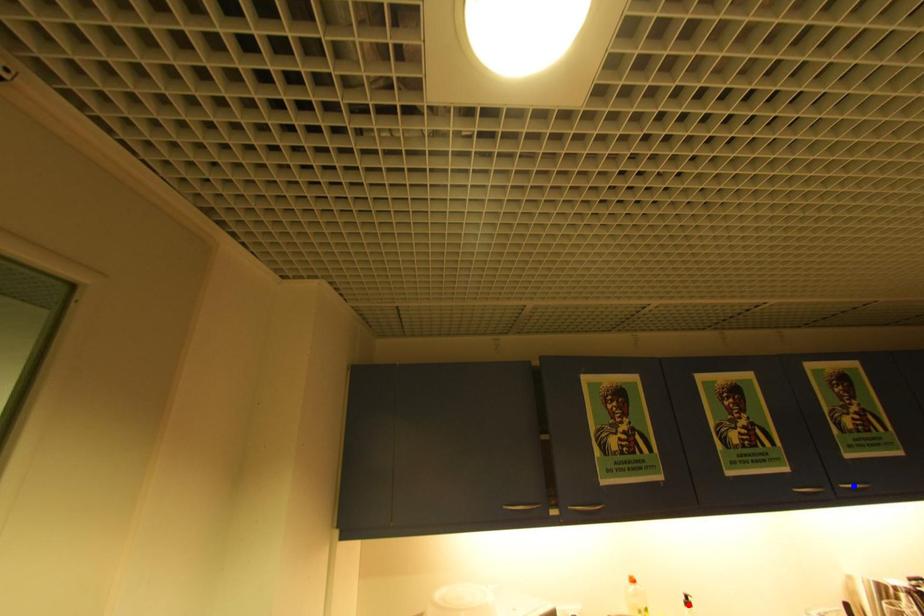
Question: Which of the two points in the image is closer to the camera?

Choices:
 (A) Blue point is closer.
 (B) Red point is closer.

Answer: (B)